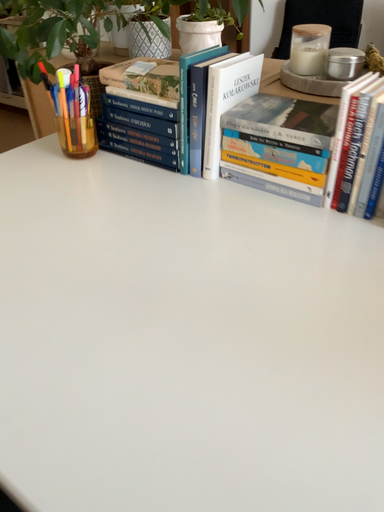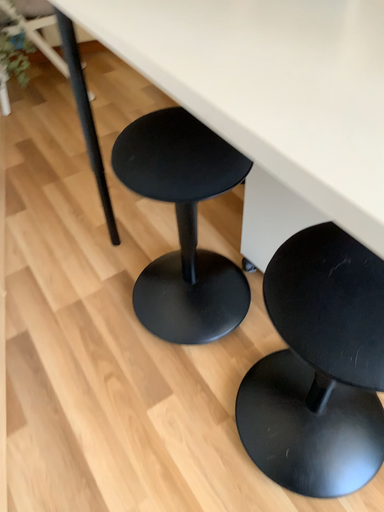
Question: Which way did the camera rotate in the video?

Choices:
 (A) rotated right
 (B) rotated left

Answer: (B)